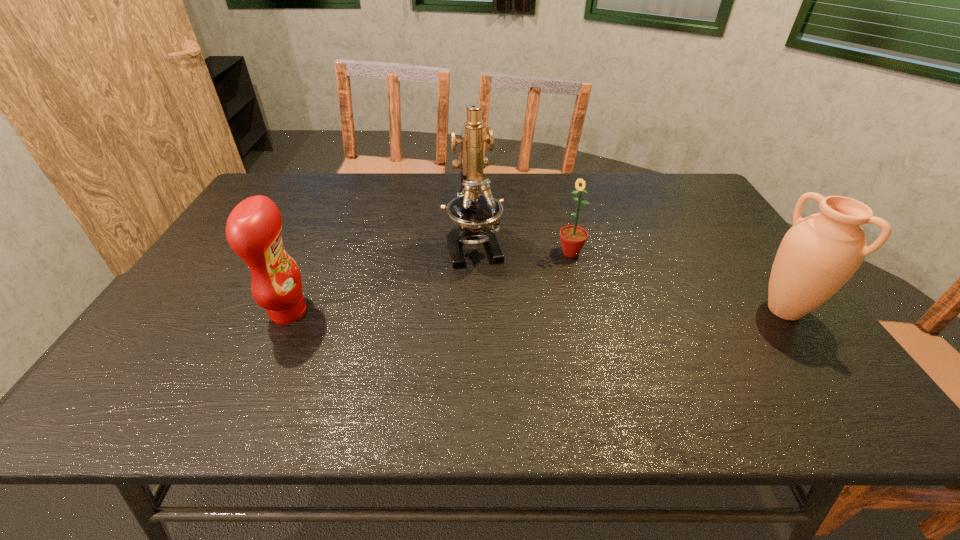
Where is `vacant region located on the face of the third object from left to right`? vacant region located on the face of the third object from left to right is located at coordinates (552, 267).

I want to click on free space located 0.240m at the eyepiece of the third object from right to left, so click(x=498, y=339).

At what (x,y) coordinates should I click in order to perform the action: click on free location located at the eyepiece of the third object from right to left. Please return your answer as a coordinate pair (x, y). Looking at the image, I should click on (505, 359).

The width and height of the screenshot is (960, 540). Identify the location of vacant space located 0.230m at the eyepiece of the third object from right to left. (497, 335).

Where is `object that is at the right edge`? object that is at the right edge is located at coordinates (820, 253).

Identify the location of free space at the far edge. This screenshot has width=960, height=540. (537, 176).

What are the coordinates of `vacant space at the near edge of the desktop` in the screenshot? It's located at (698, 348).

This screenshot has width=960, height=540. In order to click on vacant space at the left edge of the desktop in this screenshot , I will do `click(208, 276)`.

Locate an element on the screen. This screenshot has height=540, width=960. vacant area that lies between the rightmost object and the second object from left to right is located at coordinates tap(629, 277).

Identify the location of free space between the condiment and the microscope. This screenshot has width=960, height=540. (381, 278).